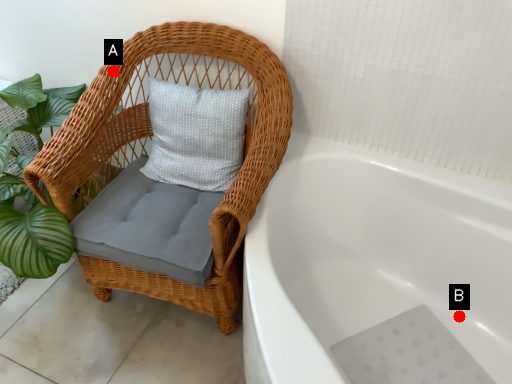
Question: Two points are circled on the image, labeled by A and B beside each circle. Which point is closer to the camera taking this photo?

Choices:
 (A) A is closer
 (B) B is closer

Answer: (A)